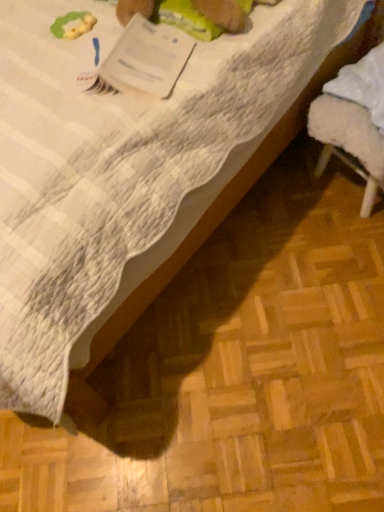
I want to click on free location to the left of white fluffy stool at lower right, so coord(281,204).